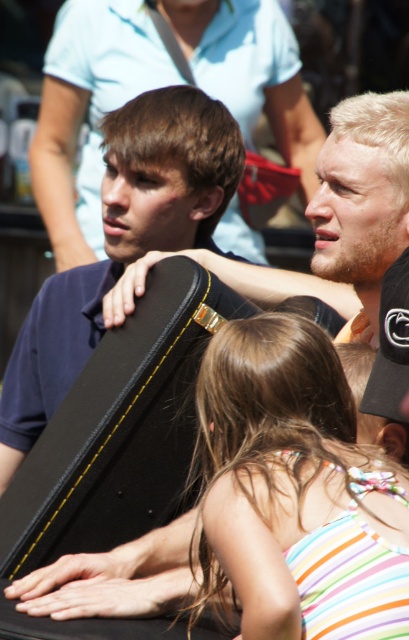
Question: Which point is farther to the camera?

Choices:
 (A) (388, 384)
 (B) (213, 180)

Answer: (B)

Question: Does matte black guitar case at center appear on the right side of black fabric baseball cap at upper right?

Choices:
 (A) no
 (B) yes

Answer: (A)

Question: Estimate the real-world distances between objects in this image. Which object is farther from the striped fabric dress at center?

Choices:
 (A) black fabric baseball cap at upper right
 (B) matte black guitar case at center

Answer: (B)

Question: Among these points, which one is farthest from the camera?

Choices:
 (A) (290, 596)
 (B) (204, 99)
 (C) (406, 269)

Answer: (B)

Question: Is matte black guitar case at center closer to the viewer compared to black fabric baseball cap at upper right?

Choices:
 (A) no
 (B) yes

Answer: (A)

Question: Is matte black guitar case at center to the right of black fabric baseball cap at upper right from the viewer's perspective?

Choices:
 (A) no
 (B) yes

Answer: (A)